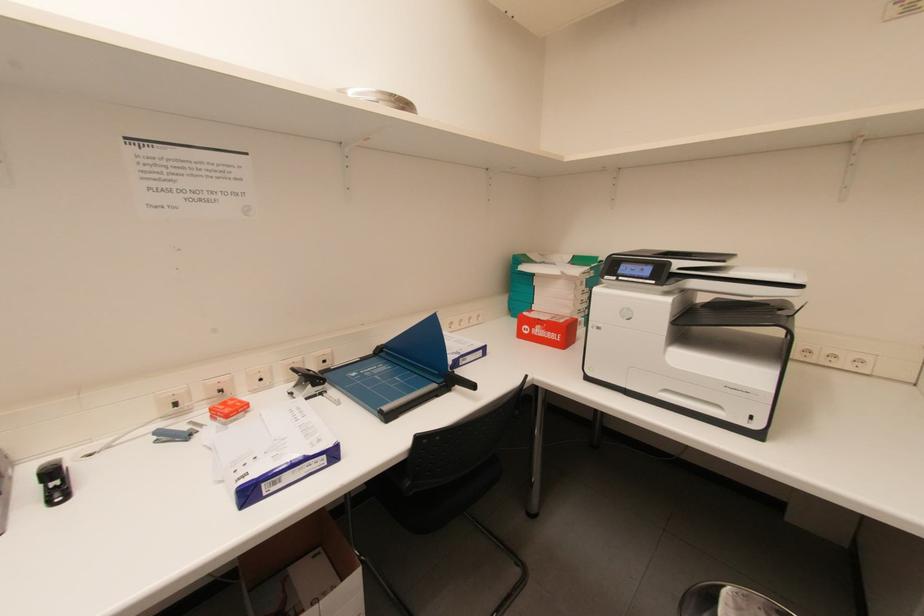
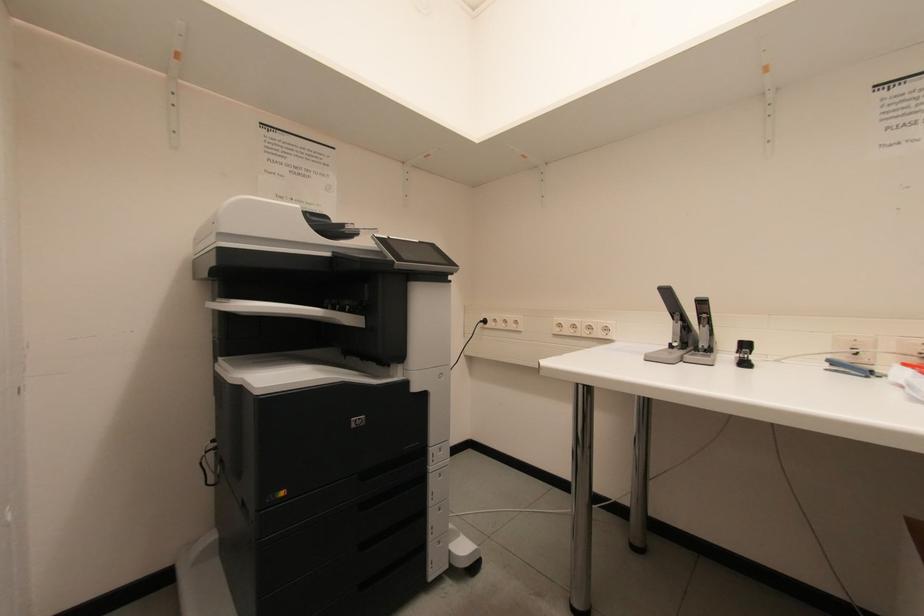
Question: The camera is either moving clockwise (left) or counter-clockwise (right) around the object. The first image is from the beginning of the video and the second image is from the end. Is the camera moving left or right when shooting the video?

Choices:
 (A) Left
 (B) Right

Answer: (B)